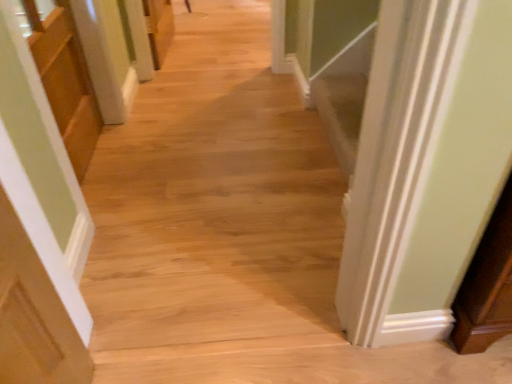
Question: Can you confirm if natural wood floor at center is bigger than matte wood cabinet at left?

Choices:
 (A) yes
 (B) no

Answer: (A)

Question: From the image's perspective, would you say natural wood floor at center is shown under matte wood cabinet at left?

Choices:
 (A) no
 (B) yes

Answer: (B)

Question: Is natural wood floor at center at the right side of matte wood cabinet at left?

Choices:
 (A) yes
 (B) no

Answer: (A)

Question: Is the depth of natural wood floor at center less than that of matte wood cabinet at left?

Choices:
 (A) no
 (B) yes

Answer: (B)

Question: From the image's perspective, would you say natural wood floor at center is positioned over matte wood cabinet at left?

Choices:
 (A) no
 (B) yes

Answer: (A)

Question: Does natural wood floor at center have a greater height compared to matte wood cabinet at left?

Choices:
 (A) no
 (B) yes

Answer: (B)

Question: Is matte wood cabinet at left not near natural wood floor at center?

Choices:
 (A) yes
 (B) no

Answer: (B)

Question: From a real-world perspective, is matte wood cabinet at left located beneath natural wood floor at center?

Choices:
 (A) no
 (B) yes

Answer: (B)

Question: Does matte wood cabinet at left touch natural wood floor at center?

Choices:
 (A) yes
 (B) no

Answer: (B)

Question: Considering the relative sizes of matte wood cabinet at left and natural wood floor at center in the image provided, is matte wood cabinet at left bigger than natural wood floor at center?

Choices:
 (A) yes
 (B) no

Answer: (B)

Question: From a real-world perspective, is matte wood cabinet at left over natural wood floor at center?

Choices:
 (A) yes
 (B) no

Answer: (B)

Question: Could you tell me if matte wood cabinet at left is turned towards natural wood floor at center?

Choices:
 (A) yes
 (B) no

Answer: (B)

Question: Visually, is matte wood cabinet at left positioned to the left or to the right of natural wood floor at center?

Choices:
 (A) left
 (B) right

Answer: (A)